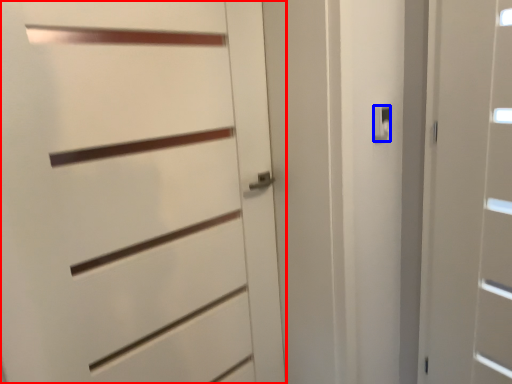
Question: Which object appears closest to the camera in this image, door (highlighted by a red box) or latch (highlighted by a blue box)?

Choices:
 (A) door
 (B) latch

Answer: (A)